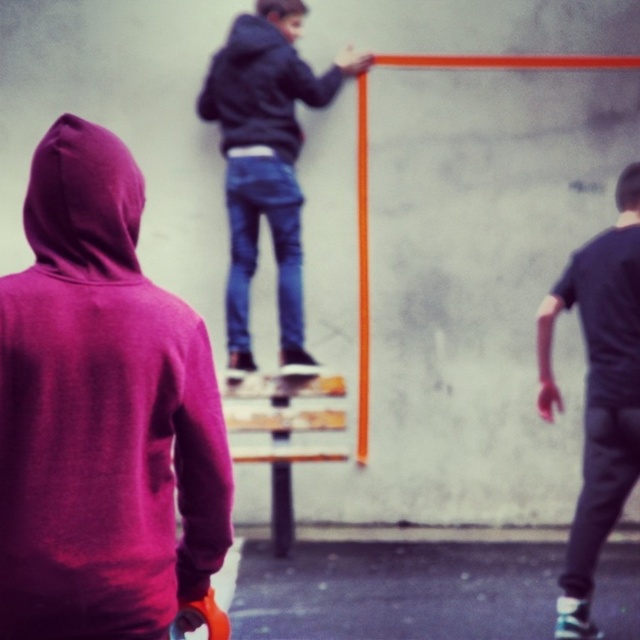
Who is positioned more to the right, purple fleece hoodie at left or dark gray t-shirt at right?

dark gray t-shirt at right

Is purple fleece hoodie at left thinner than dark gray t-shirt at right?

In fact, purple fleece hoodie at left might be wider than dark gray t-shirt at right.

This screenshot has height=640, width=640. In order to click on purple fleece hoodie at left in this screenshot , I will do `click(100, 412)`.

Locate an element on the screen. The height and width of the screenshot is (640, 640). purple fleece hoodie at left is located at coordinates (100, 412).

Who is more distant from viewer, (276, 212) or (612, 412)?

The point (276, 212) is more distant.

This screenshot has height=640, width=640. I want to click on matte black hoodie at upper center, so click(266, 161).

Looking at this image, who is more distant from viewer, (112, 416) or (241, 291)?

The point (241, 291) is behind.

Can you confirm if purple fleece hoodie at left is positioned above matte black hoodie at upper center?

No, purple fleece hoodie at left is not above matte black hoodie at upper center.

Locate an element on the screen. This screenshot has width=640, height=640. purple fleece hoodie at left is located at coordinates [x=100, y=412].